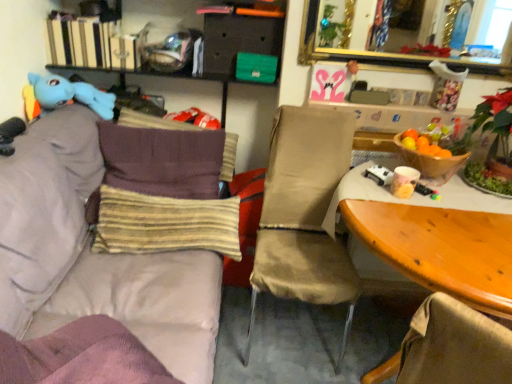
Measure the distance between yellow striped fabric pillow at center, arranged as the second pillow when viewed from the back, and camera.

yellow striped fabric pillow at center, arranged as the second pillow when viewed from the back, is 5.93 feet from camera.

What do you see at coordinates (166, 224) in the screenshot? This screenshot has height=384, width=512. I see `yellow striped fabric pillow at center, arranged as the second pillow when viewed from the back` at bounding box center [166, 224].

This screenshot has width=512, height=384. Identify the location of brown striped pillow at left, which appears as the first pillow when viewed from the back. (x=162, y=160).

Describe the element at coordinates (79, 41) in the screenshot. I see `hardcover books at upper left` at that location.

In order to click on yellow striped fabric pillow at center, the first pillow viewed from the front in this screenshot , I will do `click(166, 224)`.

Consider the image. From a real-world perspective, is matte black drawer at upper center physically located above or below yellow striped fabric pillow at center, the first pillow viewed from the front?

Clearly, from a real-world perspective, matte black drawer at upper center is above yellow striped fabric pillow at center, the first pillow viewed from the front.

Who is smaller, matte black drawer at upper center or yellow striped fabric pillow at center, the first pillow viewed from the front?

matte black drawer at upper center is smaller.

From the image's perspective, is matte black drawer at upper center on yellow striped fabric pillow at center, arranged as the second pillow when viewed from the back?

Correct, matte black drawer at upper center appears higher than yellow striped fabric pillow at center, arranged as the second pillow when viewed from the back, in the image.

Consider the image. Is there a large distance between matte black drawer at upper center and yellow striped fabric pillow at center, the first pillow viewed from the front?

No, matte black drawer at upper center is not far away from yellow striped fabric pillow at center, the first pillow viewed from the front.

Considering the relative sizes of light purple fabric couch at left and matte black drawer at upper center in the image provided, is light purple fabric couch at left wider than matte black drawer at upper center?

Yes, light purple fabric couch at left is wider than matte black drawer at upper center.

Locate an element on the screen. The image size is (512, 384). studio couch in front of the matte black drawer at upper center is located at coordinates (104, 242).

From the image's perspective, is light purple fabric couch at left positioned above or below matte black drawer at upper center?

light purple fabric couch at left is situated lower than matte black drawer at upper center in the image.

Which is more to the right, light purple fabric couch at left or matte black drawer at upper center?

From the viewer's perspective, matte black drawer at upper center appears more on the right side.

Is yellow striped fabric pillow at center, the first pillow viewed from the front, oriented towards brown striped pillow at left, which appears as the first pillow when viewed from the back?

No.

Image resolution: width=512 pixels, height=384 pixels. Find the location of `pillow below the brown striped pillow at left, which appears as the first pillow when viewed from the back (from a real-world perspective)`. pillow below the brown striped pillow at left, which appears as the first pillow when viewed from the back (from a real-world perspective) is located at coordinates (166, 224).

From the image's perspective, does yellow striped fabric pillow at center, arranged as the second pillow when viewed from the back, appear lower than brown striped pillow at left, which appears as the first pillow when viewed from the back?

Yes, from the image's perspective, yellow striped fabric pillow at center, arranged as the second pillow when viewed from the back, is below brown striped pillow at left, which appears as the first pillow when viewed from the back.

Which object is wider, brown striped pillow at left, which appears as the first pillow when viewed from the back, or wooden table at right?

Wider between the two is wooden table at right.

Is brown striped pillow at left, which is the second pillow from front to back, aimed at wooden table at right?

No, brown striped pillow at left, which is the second pillow from front to back, is not turned towards wooden table at right.

Is brown striped pillow at left, which is the second pillow from front to back, taller or shorter than wooden table at right?

brown striped pillow at left, which is the second pillow from front to back, is shorter than wooden table at right.

Considering the relative sizes of brown striped pillow at left, which appears as the first pillow when viewed from the back, and wooden table at right in the image provided, is brown striped pillow at left, which appears as the first pillow when viewed from the back, bigger than wooden table at right?

No.

Considering the sizes of objects matte black drawer at upper center and hardcover books at upper left in the image provided, who is shorter, matte black drawer at upper center or hardcover books at upper left?

matte black drawer at upper center.

Is point (261, 29) farther from camera compared to point (61, 47)?

Yes, point (261, 29) is farther from viewer.

Can you confirm if matte black drawer at upper center is smaller than hardcover books at upper left?

Yes.

Between matte black drawer at upper center and hardcover books at upper left, which one appears on the right side from the viewer's perspective?

matte black drawer at upper center.

From the image's perspective, is hardcover books at upper left on wooden table at right?

Yes, from the image's perspective, hardcover books at upper left is on top of wooden table at right.

Is hardcover books at upper left smaller than wooden table at right?

Yes.

Do you think hardcover books at upper left is within wooden table at right, or outside of it?

hardcover books at upper left is spatially situated outside wooden table at right.

Where is `book that is on the left side of wooden table at right`? The image size is (512, 384). book that is on the left side of wooden table at right is located at coordinates (79, 41).

Considering the sizes of objects light purple fabric couch at left and beige fabric chair at center in the image provided, who is bigger, light purple fabric couch at left or beige fabric chair at center?

light purple fabric couch at left is bigger.

Is light purple fabric couch at left placed right next to beige fabric chair at center?

light purple fabric couch at left and beige fabric chair at center are clearly separated.

You are a GUI agent. You are given a task and a screenshot of the screen. Output one action in this format:
    pyautogui.click(x=<x>, y=<y>)
    Task: Click on the chair that is above the light purple fabric couch at left (from the image's perspective)
    The image size is (512, 384).
    Given the screenshot: What is the action you would take?
    pyautogui.click(x=304, y=215)

Which object is positioned more to the right, light purple fabric couch at left or beige fabric chair at center?

Positioned to the right is beige fabric chair at center.

The height and width of the screenshot is (384, 512). Find the location of `drawer above the yellow striped fabric pillow at center, the first pillow viewed from the front (from a real-world perspective)`. drawer above the yellow striped fabric pillow at center, the first pillow viewed from the front (from a real-world perspective) is located at coordinates (237, 41).

Where is `studio couch in front of the matte black drawer at upper center`? This screenshot has height=384, width=512. studio couch in front of the matte black drawer at upper center is located at coordinates (104, 242).

Which object lies nearer to the anchor point yellow striped fabric pillow at center, arranged as the second pillow when viewed from the back, brown striped pillow at left, which is the second pillow from front to back, or light purple fabric couch at left?

light purple fabric couch at left is closer to yellow striped fabric pillow at center, arranged as the second pillow when viewed from the back.

Based on their spatial positions, is wooden table at right or blue plush toy at upper left further from yellow striped fabric pillow at center, arranged as the second pillow when viewed from the back?

wooden table at right is positioned further to the anchor yellow striped fabric pillow at center, arranged as the second pillow when viewed from the back.

Based on their spatial positions, is hardcover books at upper left or light purple fabric couch at left closer to yellow striped fabric pillow at center, arranged as the second pillow when viewed from the back?

Among the two, light purple fabric couch at left is located nearer to yellow striped fabric pillow at center, arranged as the second pillow when viewed from the back.

Estimate the real-world distances between objects in this image. Which object is further from yellow striped fabric pillow at center, arranged as the second pillow when viewed from the back, brown striped pillow at left, which appears as the first pillow when viewed from the back, or wooden table at right?

Among the two, wooden table at right is located further to yellow striped fabric pillow at center, arranged as the second pillow when viewed from the back.

Considering their positions, is blue plush toy at upper left positioned closer to light purple fabric couch at left than brown striped pillow at left, which is the second pillow from front to back?

The object closer to light purple fabric couch at left is brown striped pillow at left, which is the second pillow from front to back.

Based on their spatial positions, is gold-framed mirror at upper center or beige fabric chair at center closer to yellow striped fabric pillow at center, the first pillow viewed from the front?

beige fabric chair at center.

From the image, which object appears to be farther from beige fabric chair at center, blue plush toy at upper left or light purple fabric couch at left?

blue plush toy at upper left is positioned further to the anchor beige fabric chair at center.

Looking at the image, which one is located further to hardcover books at upper left, light purple fabric couch at left or wooden table at right?

The object further to hardcover books at upper left is wooden table at right.

Where is `pillow between blue plush toy at upper left and yellow striped fabric pillow at center, arranged as the second pillow when viewed from the back, from top to bottom`? This screenshot has width=512, height=384. pillow between blue plush toy at upper left and yellow striped fabric pillow at center, arranged as the second pillow when viewed from the back, from top to bottom is located at coordinates (162, 160).

You are a GUI agent. You are given a task and a screenshot of the screen. Output one action in this format:
    pyautogui.click(x=<x>, y=<y>)
    Task: Click on the toy between matte black drawer at upper center and yellow striped fabric pillow at center, the first pillow viewed from the front, in the up-down direction
    This screenshot has width=512, height=384.
    Given the screenshot: What is the action you would take?
    pyautogui.click(x=70, y=94)

Identify the location of desk located between light purple fabric couch at left and brown striped pillow at left, which is the second pillow from front to back, in the depth direction. This screenshot has height=384, width=512. (411, 197).

What are the coordinates of `chair between light purple fabric couch at left and brown striped pillow at left, which appears as the first pillow when viewed from the back, in the front-back direction` in the screenshot? It's located at (304, 215).